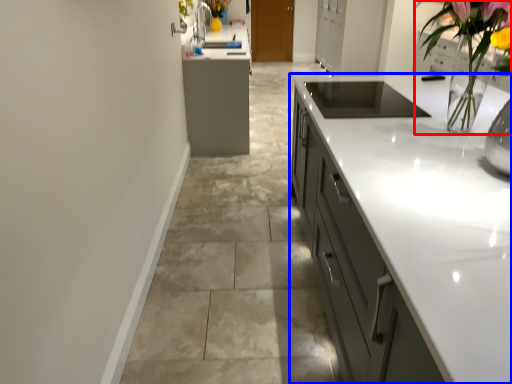
Question: Among these objects, which one is nearest to the camera, floral arrangement (highlighted by a red box) or cabinetry (highlighted by a blue box)?

Choices:
 (A) floral arrangement
 (B) cabinetry

Answer: (A)